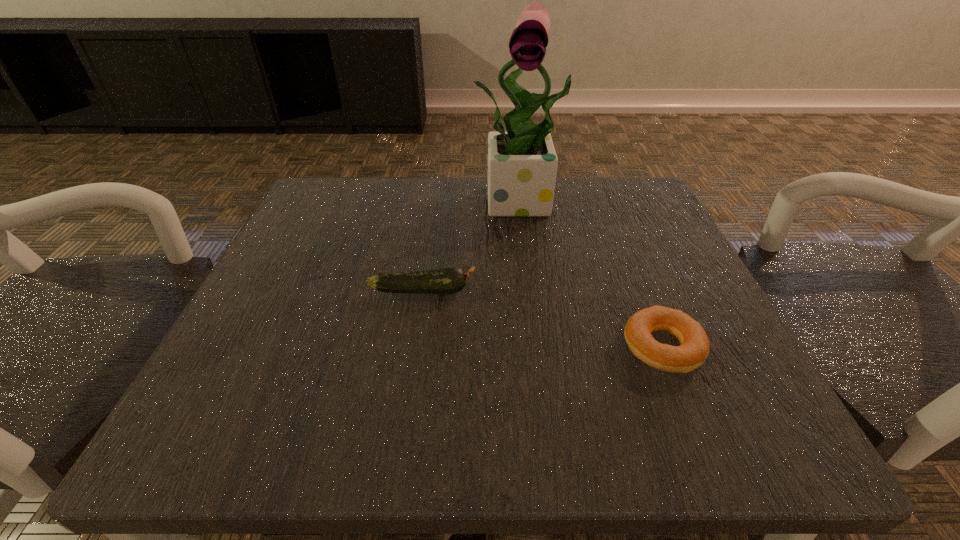
At what (x,y) coordinates should I click in order to perform the action: click on vacant area in the image that satisfies the following two spatial constraints: 1. on the front-facing side of the farthest object; 2. on the left side of the bagel. Please return your answer as a coordinate pair (x, y). Looking at the image, I should click on (545, 347).

At what (x,y) coordinates should I click in order to perform the action: click on free space that satisfies the following two spatial constraints: 1. on the front-facing side of the nearest object; 2. on the right side of the tallest object. Please return your answer as a coordinate pair (x, y). The image size is (960, 540). Looking at the image, I should click on (545, 347).

Where is `vacant space that satisfies the following two spatial constraints: 1. at the blossom end of the zucchini; 2. on the back side of the shortest object`? vacant space that satisfies the following two spatial constraints: 1. at the blossom end of the zucchini; 2. on the back side of the shortest object is located at coordinates (415, 347).

The image size is (960, 540). In order to click on free space that satisfies the following two spatial constraints: 1. on the back side of the bagel; 2. at the blossom end of the second nearest object in this screenshot , I will do `click(639, 290)`.

Locate an element on the screen. vacant space that satisfies the following two spatial constraints: 1. on the front-facing side of the rightmost object; 2. on the left side of the flower arrangement is located at coordinates (545, 347).

Find the location of `vacant area that satisfies the following two spatial constraints: 1. at the blossom end of the zucchini; 2. on the right side of the shortest object`. vacant area that satisfies the following two spatial constraints: 1. at the blossom end of the zucchini; 2. on the right side of the shortest object is located at coordinates (415, 347).

Where is `free spot that satisfies the following two spatial constraints: 1. on the front-facing side of the shortest object; 2. on the right side of the flower arrangement`? The width and height of the screenshot is (960, 540). free spot that satisfies the following two spatial constraints: 1. on the front-facing side of the shortest object; 2. on the right side of the flower arrangement is located at coordinates click(545, 347).

Where is `free space in the image that satisfies the following two spatial constraints: 1. on the front-facing side of the farthest object; 2. at the blossom end of the zucchini`? The width and height of the screenshot is (960, 540). free space in the image that satisfies the following two spatial constraints: 1. on the front-facing side of the farthest object; 2. at the blossom end of the zucchini is located at coordinates (538, 290).

I want to click on blank area in the image that satisfies the following two spatial constraints: 1. at the blossom end of the rightmost object; 2. on the right side of the zucchini, so [415, 347].